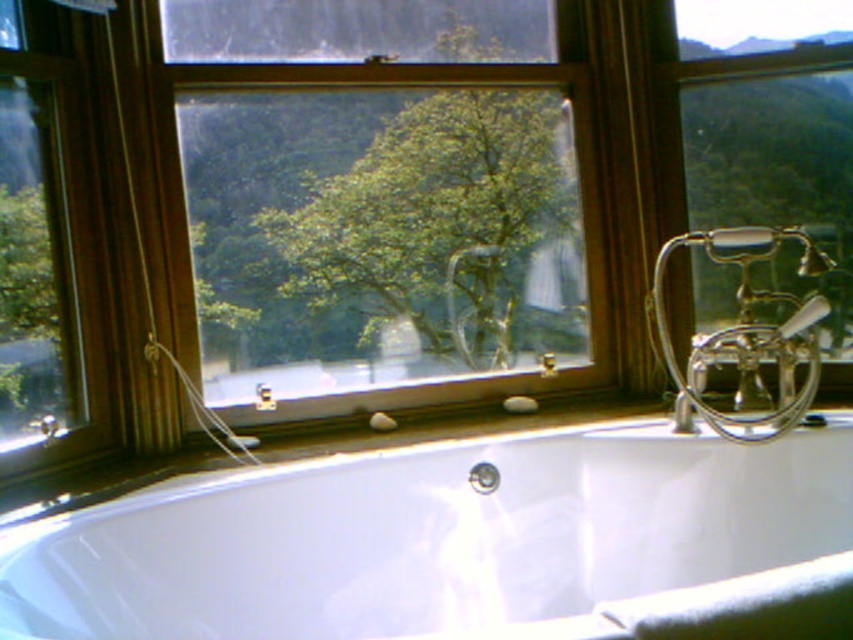
Question: Is clear glass window at upper left closer to the viewer compared to metallic/reflective mountain at upper right?

Choices:
 (A) yes
 (B) no

Answer: (A)

Question: Which point is farther from the camera taking this photo?

Choices:
 (A) (611, 547)
 (B) (334, 236)
 (C) (32, 449)
 (D) (741, 118)

Answer: (D)

Question: Among these points, which one is farthest from the camera?

Choices:
 (A) (448, 330)
 (B) (370, 474)
 (C) (738, 172)

Answer: (C)

Question: Does transparent glass window at center have a smaller size compared to clear glass window at upper left?

Choices:
 (A) yes
 (B) no

Answer: (B)

Question: Is transparent glass window at center positioned behind white glossy bathtub at center?

Choices:
 (A) no
 (B) yes

Answer: (B)

Question: Which is farther from the transparent glass window at center?

Choices:
 (A) white glossy bathtub at center
 (B) clear glass window at upper left
 (C) metallic/reflective mountain at upper right

Answer: (A)